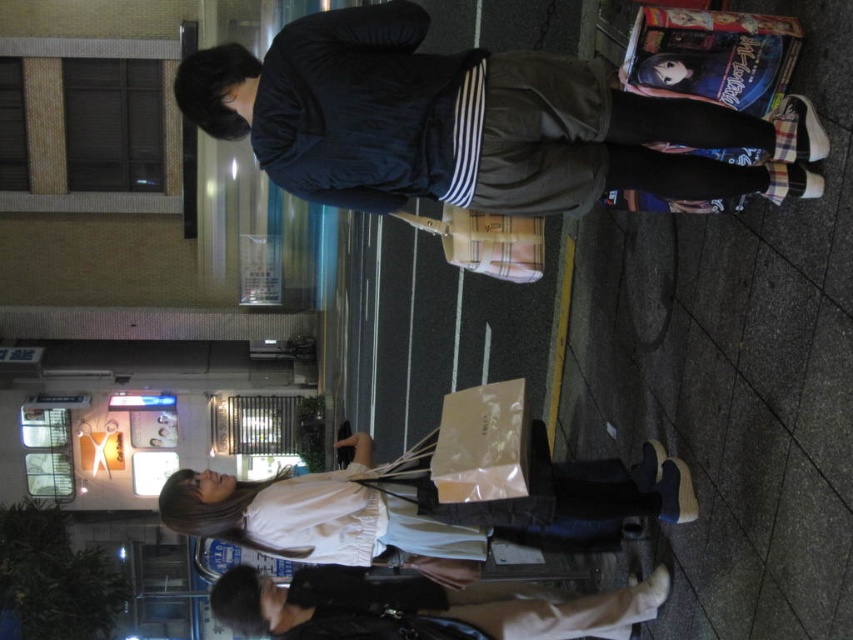
From the picture: You are standing on the smooth concrete pavement at lower right and want to step onto the light beige leather boots at lower center. Is the pavement above or below the boots?

The smooth concrete pavement at lower right is located above the light beige leather boots at lower center, so the pavement is above the boots.

You are a photographer trying to capture the smooth concrete pavement at lower right and the white cotton blouse at lower center in a single frame. Given that your camera can only focus on one object at a time, which object should you prioritize focusing on to ensure it appears sharp and clear in the photo?

You should prioritize focusing on the smooth concrete pavement at lower right because it is bigger than the white cotton blouse at lower center, making it more prominent in the frame.

You are a delivery person trying to place a package on the ground near the smooth concrete pavement at lower right and the white cotton blouse at lower center. Which object should you place the package on to ensure it stays above the other object?

→ You should place the package on the smooth concrete pavement at lower right because it is already positioned above the white cotton blouse at lower center, so the package will stay above the blouse.